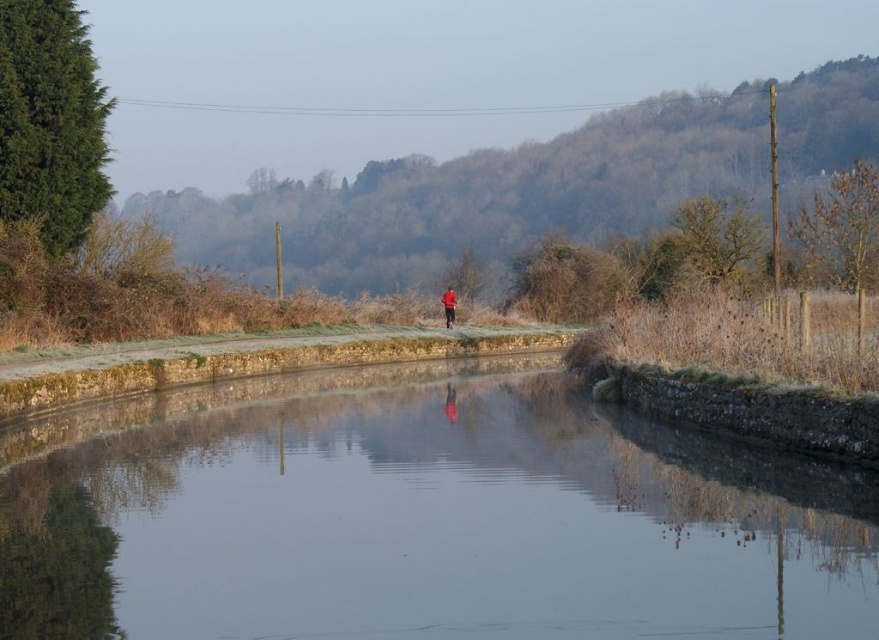
You are a photographer trying to capture the reflection of the red matte jacket at center in the clear glass water at center. Is the jacket reflected in the water?

The clear glass water at center is positioned under the red matte jacket at center, so the jacket is reflected in the water.

You are standing at the edge of the canal and see the clear glass water at center and the red matte jacket at center. Which object is closer to your left side?

The clear glass water at center is closer to your left side because it is positioned to the left of the red matte jacket at center.

You are a photographer planning to take a photo of the clear glass water at center and the red matte jacket at center. Which object should you focus on first if you want to ensure both are in sharp focus?

The clear glass water at center is not as tall as the red matte jacket at center, so you should focus on the red matte jacket at center first to ensure both are in sharp focus.